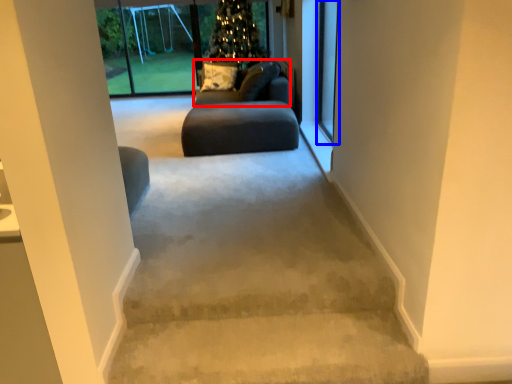
Question: Which object is closer to the camera taking this photo, couch (highlighted by a red box) or screen door (highlighted by a blue box)?

Choices:
 (A) couch
 (B) screen door

Answer: (B)